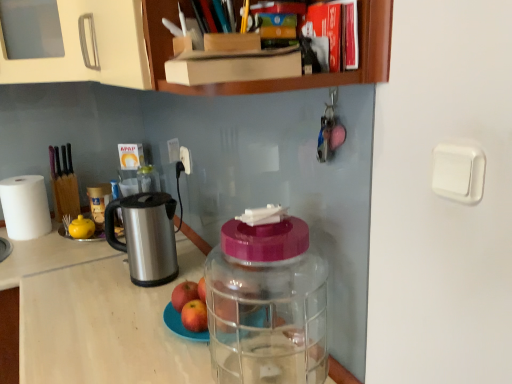
Question: Is red matte apple at center, the first apple viewed from the back, at the back of red matte apple at center, positioned as the 1th apple in front-to-back order?

Choices:
 (A) no
 (B) yes

Answer: (A)

Question: Are red matte apple at center, positioned as the 1th apple in front-to-back order, and red matte apple at center, the first apple viewed from the back, far apart?

Choices:
 (A) no
 (B) yes

Answer: (A)

Question: Does red matte apple at center, positioned as the 1th apple in front-to-back order, appear on the right side of red matte apple at center, which is the second apple in front-to-back order?

Choices:
 (A) no
 (B) yes

Answer: (B)

Question: Is red matte apple at center, positioned as the 1th apple in front-to-back order, aimed at red matte apple at center, which is the second apple in front-to-back order?

Choices:
 (A) no
 (B) yes

Answer: (A)

Question: From a real-world perspective, is red matte apple at center, the second apple from the back, located beneath red matte apple at center, the first apple viewed from the back?

Choices:
 (A) no
 (B) yes

Answer: (B)

Question: Is red matte apple at center, which is the second apple in front-to-back order, situated inside red matte apple at center, the second apple from the back, or outside?

Choices:
 (A) outside
 (B) inside

Answer: (A)

Question: Considering the positions of red matte apple at center, the first apple viewed from the back, and red matte apple at center, positioned as the 1th apple in front-to-back order, in the image, is red matte apple at center, the first apple viewed from the back, taller or shorter than red matte apple at center, positioned as the 1th apple in front-to-back order,?

Choices:
 (A) tall
 (B) short

Answer: (A)

Question: From the image's perspective, relative to red matte apple at center, positioned as the 1th apple in front-to-back order, is red matte apple at center, the first apple viewed from the back, above or below?

Choices:
 (A) above
 (B) below

Answer: (A)

Question: Considering the relative positions of red matte apple at center, which is the second apple in front-to-back order, and red matte apple at center, positioned as the 1th apple in front-to-back order, in the image provided, is red matte apple at center, which is the second apple in front-to-back order, to the left or to the right of red matte apple at center, positioned as the 1th apple in front-to-back order,?

Choices:
 (A) left
 (B) right

Answer: (A)

Question: Considering the positions of stainless steel electric kettle at left and beige wood cabinet at upper left in the image, is stainless steel electric kettle at left wider or thinner than beige wood cabinet at upper left?

Choices:
 (A) wide
 (B) thin

Answer: (B)

Question: Would you say stainless steel electric kettle at left is inside or outside beige wood cabinet at upper left?

Choices:
 (A) outside
 (B) inside

Answer: (A)

Question: From a real-world perspective, relative to beige wood cabinet at upper left, is stainless steel electric kettle at left vertically above or below?

Choices:
 (A) above
 (B) below

Answer: (B)

Question: In the image, is stainless steel electric kettle at left on the left side or the right side of beige wood cabinet at upper left?

Choices:
 (A) left
 (B) right

Answer: (B)

Question: Based on their sizes in the image, would you say white plastic power outlet at upper center is bigger or smaller than red matte apple at center, the second apple from the back?

Choices:
 (A) small
 (B) big

Answer: (A)

Question: Considering the positions of white plastic power outlet at upper center and red matte apple at center, positioned as the 1th apple in front-to-back order, in the image, is white plastic power outlet at upper center wider or thinner than red matte apple at center, positioned as the 1th apple in front-to-back order,?

Choices:
 (A) thin
 (B) wide

Answer: (A)